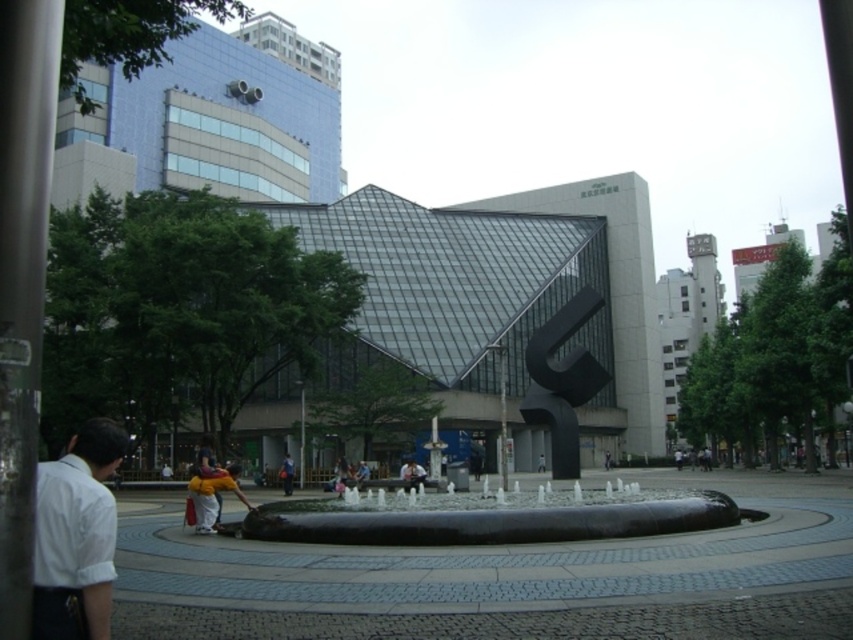
Does white matte shirt at lower left appear on the left side of yellow fabric jacket at center?

Incorrect, white matte shirt at lower left is not on the left side of yellow fabric jacket at center.

Can you confirm if white matte shirt at lower left is smaller than yellow fabric jacket at center?

Yes.

Does point (84, 618) come behind point (282, 467)?

No, it is not.

Locate an element on the screen. The image size is (853, 640). white matte shirt at lower left is located at coordinates (76, 536).

Is point (666, 520) positioned after point (634, 502)?

No, (666, 520) is closer to viewer.

Is black polished stone fountain at center above black polished water feature at center?

Yes.

Which is behind, point (587, 388) or point (715, 497)?

The point (587, 388) is behind.

Find the location of a particular element. The width and height of the screenshot is (853, 640). black polished stone fountain at center is located at coordinates (483, 522).

Can you confirm if black polished stone fountain at center is positioned to the left of yellow fabric jacket at center?

Incorrect, black polished stone fountain at center is not on the left side of yellow fabric jacket at center.

Is black polished stone fountain at center above yellow fabric jacket at center?

Indeed, black polished stone fountain at center is positioned over yellow fabric jacket at center.

This screenshot has width=853, height=640. Describe the element at coordinates (483, 522) in the screenshot. I see `black polished stone fountain at center` at that location.

Locate an element on the screen. black polished stone fountain at center is located at coordinates (483, 522).